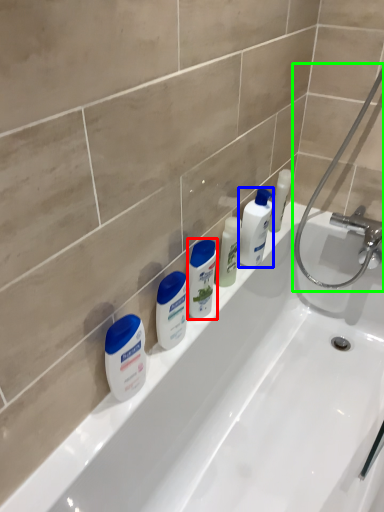
Question: Based on their relative distances, which object is farther from toiletry (highlighted by a red box)? Choose from toiletry (highlighted by a blue box) and shower (highlighted by a green box).

Choices:
 (A) toiletry
 (B) shower

Answer: (B)